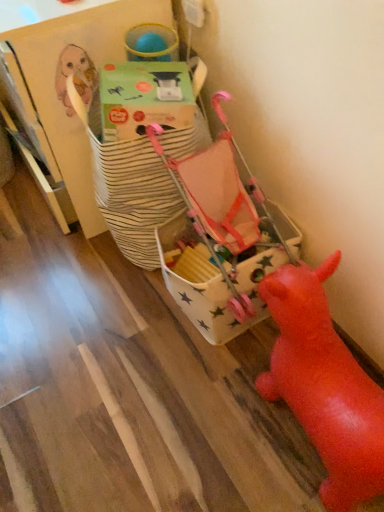
Locate an element on the screen. The width and height of the screenshot is (384, 512). vacant space in rubber red pig at lower right, the 1th toy in the front-to-back sequence (from a real-world perspective) is located at coordinates (279, 426).